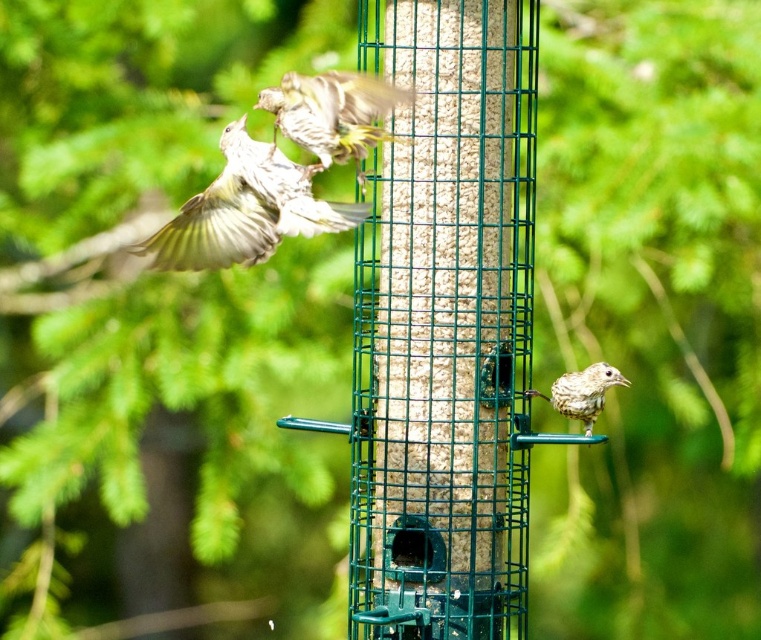
Who is higher up, brown speckled feathers at upper left or brown speckled feathers at upper center?

Positioned higher is brown speckled feathers at upper center.

Can you confirm if brown speckled feathers at upper left is smaller than brown speckled feathers at upper center?

Incorrect, brown speckled feathers at upper left is not smaller in size than brown speckled feathers at upper center.

Between point (212, 208) and point (387, 112), which one is positioned in front?

Positioned in front is point (387, 112).

Locate an element on the screen. The image size is (761, 640). brown speckled feathers at upper left is located at coordinates pyautogui.click(x=244, y=211).

Is brown speckled feathers at upper left above brown speckled bird at lower right?

Yes, brown speckled feathers at upper left is above brown speckled bird at lower right.

Can you confirm if brown speckled feathers at upper left is positioned to the right of brown speckled bird at lower right?

Incorrect, brown speckled feathers at upper left is not on the right side of brown speckled bird at lower right.

Find the location of a particular element. brown speckled feathers at upper left is located at coordinates (244, 211).

You are a GUI agent. You are given a task and a screenshot of the screen. Output one action in this format:
    pyautogui.click(x=<x>, y=<y>)
    Task: Click on the brown speckled feathers at upper left
    
    Given the screenshot: What is the action you would take?
    pyautogui.click(x=244, y=211)

Is brown speckled feathers at upper center taller than brown speckled bird at lower right?

Yes.

Is point (368, 97) positioned after point (565, 394)?

No, (368, 97) is in front of (565, 394).

Where is `brown speckled feathers at upper center`? The image size is (761, 640). brown speckled feathers at upper center is located at coordinates (333, 113).